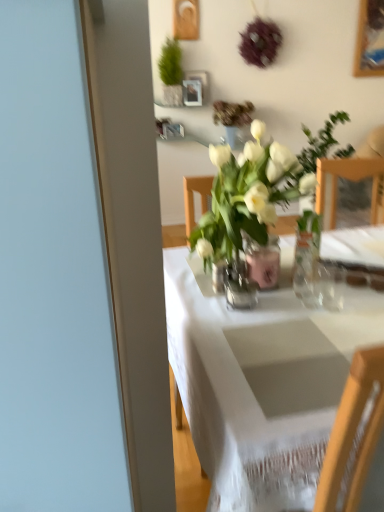
This screenshot has width=384, height=512. I want to click on free spot behind clear glass vase at center, acting as the first vase starting from the front, so click(212, 280).